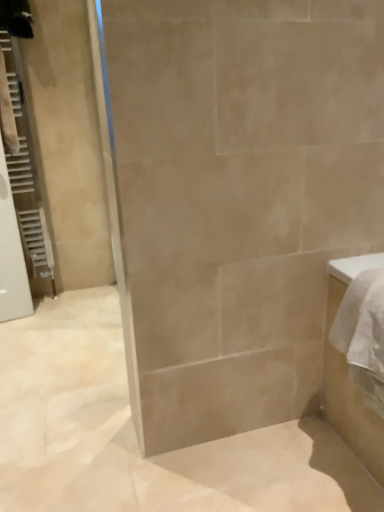
What do you see at coordinates (26, 175) in the screenshot? The width and height of the screenshot is (384, 512). I see `white textured radiator at left` at bounding box center [26, 175].

Image resolution: width=384 pixels, height=512 pixels. I want to click on white textured radiator at left, so click(x=26, y=175).

Measure the distance between white glossy cabinet at right and camera.

white glossy cabinet at right and camera are 1.10 meters apart.

What do you see at coordinates (347, 375) in the screenshot? Image resolution: width=384 pixels, height=512 pixels. I see `white glossy cabinet at right` at bounding box center [347, 375].

Identify the location of white glossy cabinet at right. (347, 375).

Identify the location of white textured radiator at left. The width and height of the screenshot is (384, 512). (26, 175).

Which is more to the right, white textured radiator at left or white glossy cabinet at right?

From the viewer's perspective, white glossy cabinet at right appears more on the right side.

Is the position of white textured radiator at left less distant than that of white glossy cabinet at right?

No, white textured radiator at left is behind white glossy cabinet at right.

Is point (17, 49) closer or farther from the camera than point (381, 473)?

Point (17, 49) appears to be farther away from the viewer than point (381, 473).

From the image's perspective, who appears lower, white textured radiator at left or white glossy cabinet at right?

white glossy cabinet at right, from the image's perspective.

From a real-world perspective, is white textured radiator at left over white glossy cabinet at right?

Indeed, from a real-world perspective, white textured radiator at left stands above white glossy cabinet at right.

Which object is wider, white textured radiator at left or white glossy cabinet at right?

With larger width is white glossy cabinet at right.

Based on the photo, is white textured radiator at left shorter than white glossy cabinet at right?

No.

Considering the sizes of objects white textured radiator at left and white glossy cabinet at right in the image provided, who is bigger, white textured radiator at left or white glossy cabinet at right?

Bigger between the two is white glossy cabinet at right.

Is white textured radiator at left surrounding white glossy cabinet at right?

No.

Is white textured radiator at left far away from white glossy cabinet at right?

white textured radiator at left is positioned a significant distance from white glossy cabinet at right.

Is white textured radiator at left positioned with its back to white glossy cabinet at right?

That's not correct — white textured radiator at left is not looking away from white glossy cabinet at right.

What's the angular difference between white textured radiator at left and white glossy cabinet at right's facing directions?

The angular difference between white textured radiator at left and white glossy cabinet at right is 90 degrees.

This screenshot has height=512, width=384. I want to click on screen door above the white glossy cabinet at right (from the image's perspective), so click(x=26, y=175).

Considering the relative positions of white glossy cabinet at right and white textured radiator at left in the image provided, is white glossy cabinet at right to the right of white textured radiator at left from the viewer's perspective?

Correct, you'll find white glossy cabinet at right to the right of white textured radiator at left.

Is white glossy cabinet at right in front of or behind white textured radiator at left in the image?

In the image, white glossy cabinet at right appears in front of white textured radiator at left.

Which is in front, point (340, 293) or point (23, 175)?

Point (340, 293)

From the image's perspective, is white glossy cabinet at right above white textured radiator at left?

Actually, white glossy cabinet at right appears below white textured radiator at left in the image.

From the picture: From a real-world perspective, between white glossy cabinet at right and white textured radiator at left, who is vertically higher?

white textured radiator at left, from a real-world perspective.

Can you confirm if white glossy cabinet at right is thinner than white textured radiator at left?

Incorrect, the width of white glossy cabinet at right is not less than that of white textured radiator at left.

Considering the relative sizes of white glossy cabinet at right and white textured radiator at left in the image provided, is white glossy cabinet at right shorter than white textured radiator at left?

Yes, white glossy cabinet at right is shorter than white textured radiator at left.

From the picture: Considering the sizes of objects white glossy cabinet at right and white textured radiator at left in the image provided, who is smaller, white glossy cabinet at right or white textured radiator at left?

white textured radiator at left.

Can we say white glossy cabinet at right lies outside white textured radiator at left?

white glossy cabinet at right lies outside white textured radiator at left's area.

Is the surface of white glossy cabinet at right in direct contact with white textured radiator at left?

No, white glossy cabinet at right is not beside white textured radiator at left.

Is white glossy cabinet at right turned away from white textured radiator at left?

No, white textured radiator at left is not at the back of white glossy cabinet at right.

Can you tell me how much white glossy cabinet at right and white textured radiator at left differ in facing direction?

There is a 90-degree angle between the facing directions of white glossy cabinet at right and white textured radiator at left.

In order to click on screen door that is above the white glossy cabinet at right (from the image's perspective) in this screenshot , I will do `click(26, 175)`.

Where is `screen door located behind the white glossy cabinet at right`? The height and width of the screenshot is (512, 384). screen door located behind the white glossy cabinet at right is located at coordinates (26, 175).

What are the coordinates of `bathroom cabinet to the right of white textured radiator at left` in the screenshot? It's located at (347, 375).